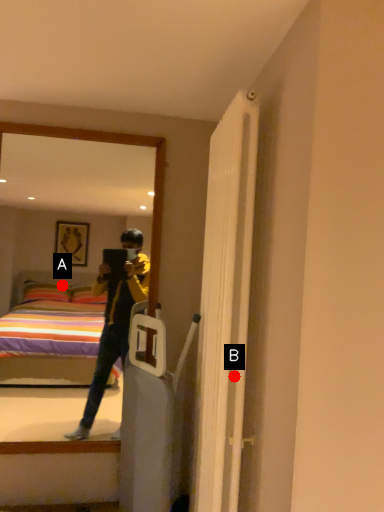
Question: Two points are circled on the image, labeled by A and B beside each circle. Which point is closer to the camera?

Choices:
 (A) A is closer
 (B) B is closer

Answer: (B)